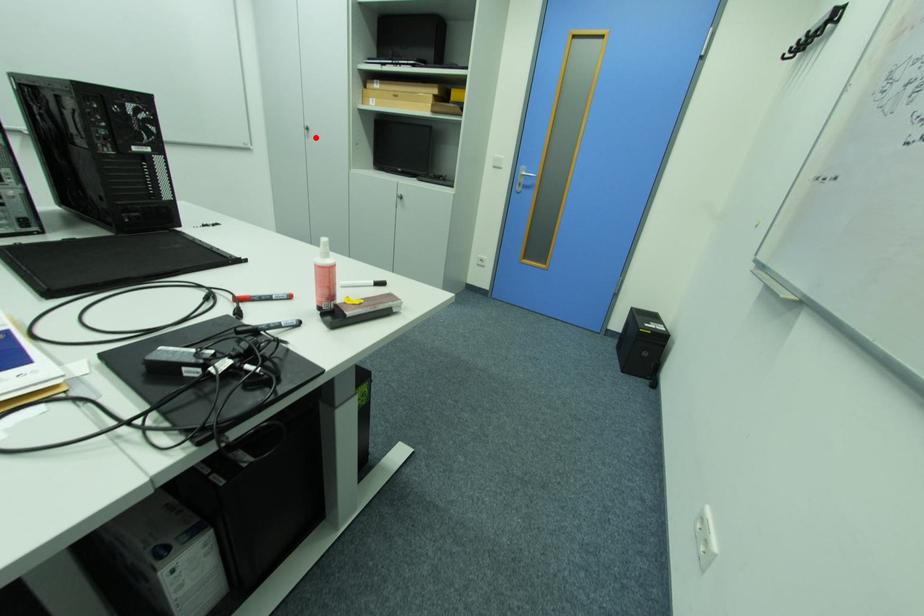
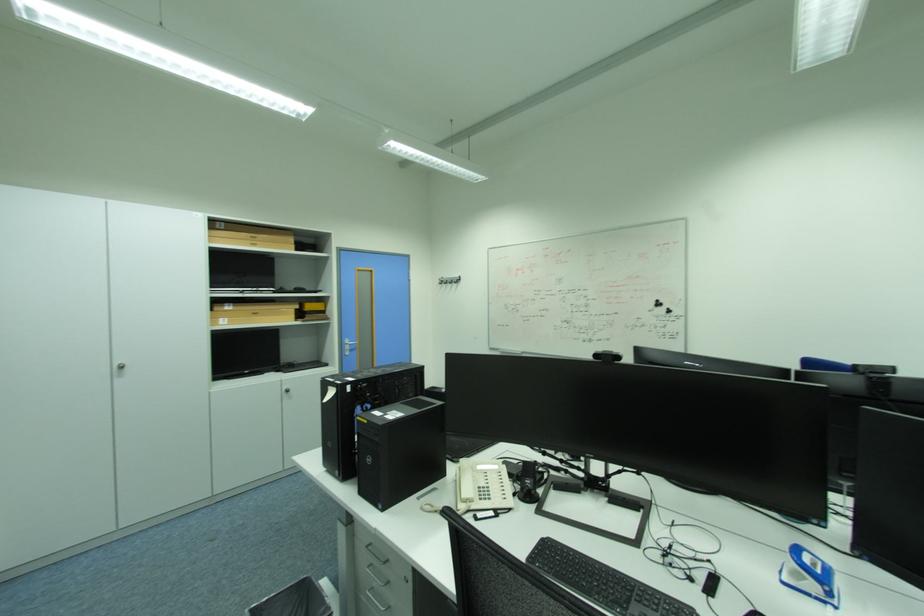
Question: I am providing you with two images of the same scene from different viewpoints. In image1, a red point is highlighted. Considering the same 3D point in image2, which of the following is correct?

Choices:
 (A) It is closer
 (B) It is farther

Answer: (B)